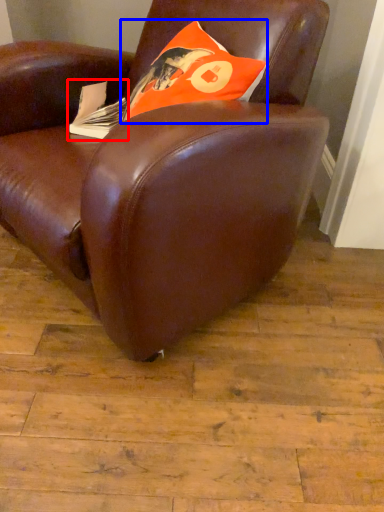
Question: Among these objects, which one is nearest to the camera, paperback book (highlighted by a red box) or throw pillow (highlighted by a blue box)?

Choices:
 (A) paperback book
 (B) throw pillow

Answer: (B)